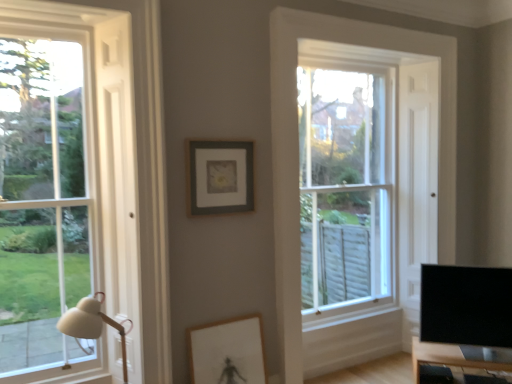
Question: Considering the positions of white matte table lamp at left and clear glass window at center, the 2th window from the left, in the image, is white matte table lamp at left taller or shorter than clear glass window at center, the 2th window from the left,?

Choices:
 (A) short
 (B) tall

Answer: (A)

Question: In terms of size, does white matte table lamp at left appear bigger or smaller than clear glass window at center, the second window viewed from the front?

Choices:
 (A) small
 (B) big

Answer: (A)

Question: Estimate the real-world distances between objects in this image. Which object is closer to the wooden table at lower right?

Choices:
 (A) clear glass window at center, the 2th window from the left
 (B) matte gray picture frame at center, which is counted as the 1th picture frame, starting from the top
 (C) white matte table lamp at left
 (D) matte wooden picture frame at center, acting as the 2th picture frame starting from the top
 (E) clear glass window at left, acting as the 2th window starting from the back

Answer: (A)

Question: Which object is positioned farthest from the clear glass window at center, the 2th window from the left?

Choices:
 (A) wooden table at lower right
 (B) matte wooden picture frame at center, acting as the 2th picture frame starting from the top
 (C) matte gray picture frame at center, which ranks as the second picture frame in bottom-to-top order
 (D) clear glass window at left, the 1th window from the front
 (E) white matte table lamp at left

Answer: (E)